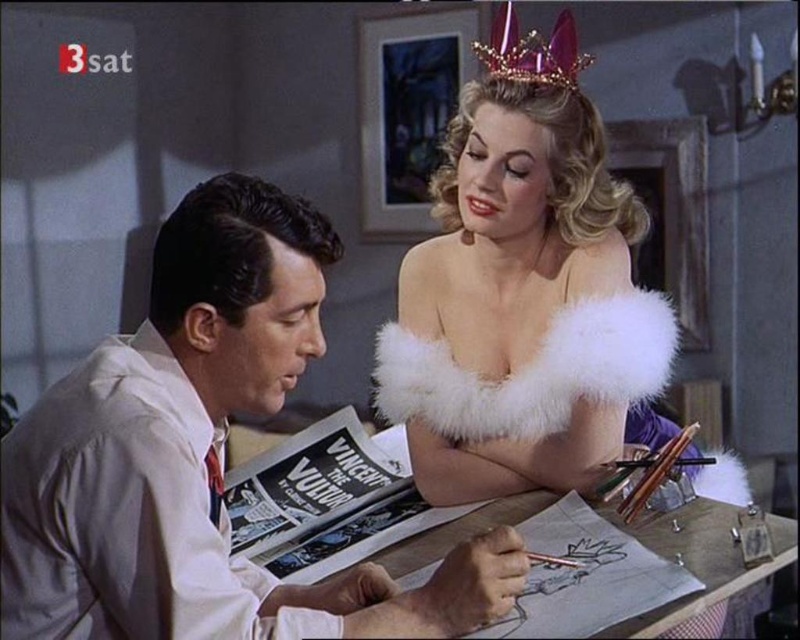
What do you see at coordinates (200, 456) in the screenshot? Image resolution: width=800 pixels, height=640 pixels. I see `white satin shirt at left` at bounding box center [200, 456].

Where is `white satin shirt at left`? The width and height of the screenshot is (800, 640). white satin shirt at left is located at coordinates (200, 456).

Locate an element on the screen. The image size is (800, 640). white fur arm band at upper right is located at coordinates (514, 284).

Locate an element on the screen. The height and width of the screenshot is (640, 800). white fur arm band at upper right is located at coordinates (514, 284).

What do you see at coordinates (200, 456) in the screenshot? I see `white satin shirt at left` at bounding box center [200, 456].

Is white satin shirt at left further to camera compared to purple metallic crown at upper center?

No, it is in front of purple metallic crown at upper center.

What do you see at coordinates (200, 456) in the screenshot? The width and height of the screenshot is (800, 640). I see `white satin shirt at left` at bounding box center [200, 456].

Locate an element on the screen. This screenshot has height=640, width=800. white satin shirt at left is located at coordinates (200, 456).